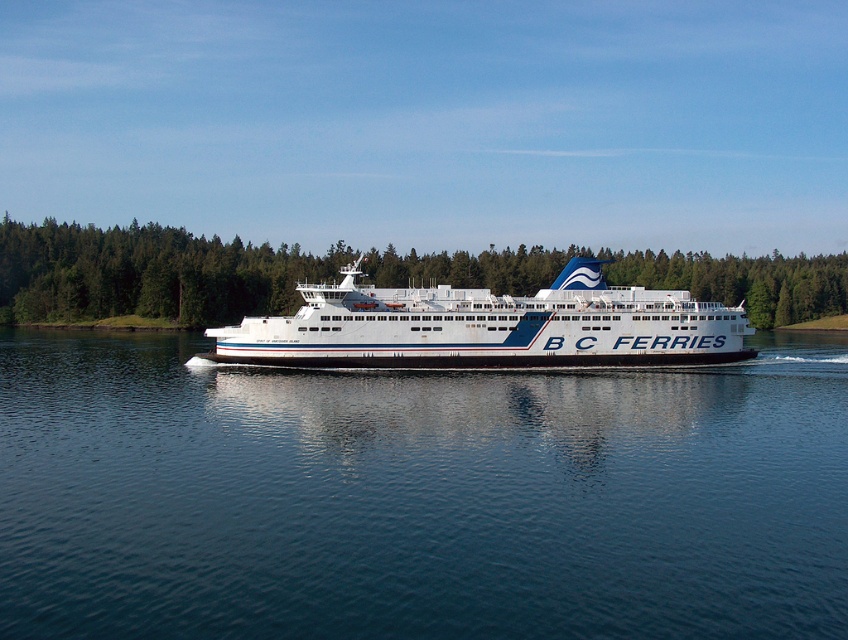
You are a passenger on the ferry and looking out the window. You see the green leafy forest at center and the white glossy ferry at center. Which one is closer to you?

The white glossy ferry at center is closer to you because it is positioned under the green leafy forest at center, meaning the ferry is in front of the forest.

You are a photographer on the BC Ferries vessel and want to capture the blue water at center and the green leafy forest at center in your shot. Which of the two elements appears closer to the camera based on their height in the image?

The blue water at center has a lesser height compared to the green leafy forest at center, so the green leafy forest at center appears closer to the camera.

You are a passenger on the ferry and want to know if the blue water at center takes up more space than the white glossy ferry at center in the image. What can you observe?

The blue water at center occupies less space than the white glossy ferry at center, so the ferry takes up more space in the image.